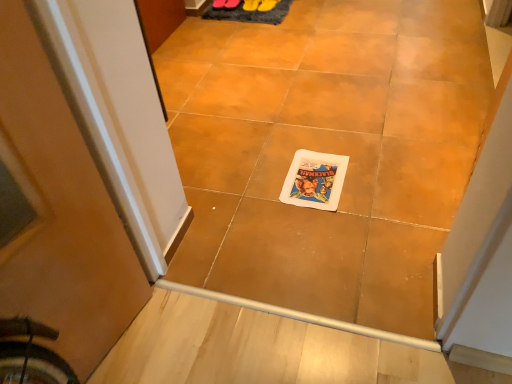
Question: From a real-world perspective, is white matte tile at center beneath matte paper comic book at center?

Choices:
 (A) yes
 (B) no

Answer: (B)

Question: Is white matte tile at center positioned with its back to matte paper comic book at center?

Choices:
 (A) no
 (B) yes

Answer: (B)

Question: Is white matte tile at center bigger than matte paper comic book at center?

Choices:
 (A) yes
 (B) no

Answer: (A)

Question: From a real-world perspective, is white matte tile at center positioned over matte paper comic book at center based on gravity?

Choices:
 (A) no
 (B) yes

Answer: (B)

Question: From the image's perspective, would you say white matte tile at center is positioned over matte paper comic book at center?

Choices:
 (A) yes
 (B) no

Answer: (A)

Question: Is white matte tile at center to the right of matte paper comic book at center from the viewer's perspective?

Choices:
 (A) no
 (B) yes

Answer: (A)

Question: Does yellow rubber boot at center, the 1th footwear viewed from the left, have a smaller size compared to matte paper comic book at center?

Choices:
 (A) no
 (B) yes

Answer: (B)

Question: From a real-world perspective, is yellow rubber boot at center, the 1th footwear viewed from the left, below matte paper comic book at center?

Choices:
 (A) yes
 (B) no

Answer: (B)

Question: Is yellow rubber boot at center, the 1th footwear viewed from the left, to the right of matte paper comic book at center from the viewer's perspective?

Choices:
 (A) yes
 (B) no

Answer: (B)

Question: Is yellow rubber boot at center, the 1th footwear viewed from the left, not inside matte paper comic book at center?

Choices:
 (A) no
 (B) yes

Answer: (B)

Question: Can you see yellow rubber boot at center, which is counted as the second footwear, starting from the right, touching matte paper comic book at center?

Choices:
 (A) yes
 (B) no

Answer: (B)

Question: From the image's perspective, does rubber yellow shoe at upper center, which is the second footwear in left-to-right order, appear higher than matte paper comic book at center?

Choices:
 (A) no
 (B) yes

Answer: (B)